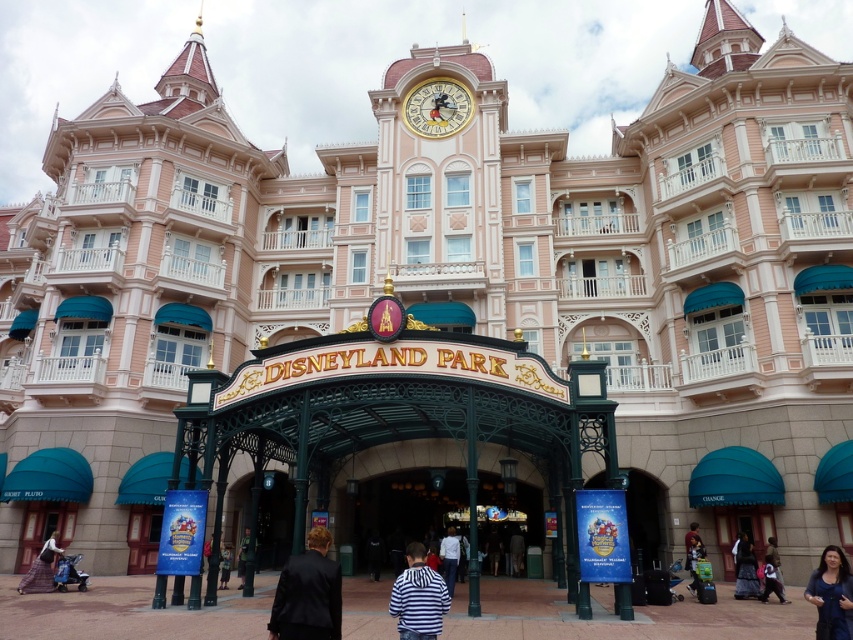
You are a photographer standing at the entrance of Disneyland Park. You want to capture a photo of both the blue satin dress at lower right and the dark blue fabric pants at lower right in the same frame. Given that your camera has a maximum focal length that allows capturing objects up to 12 meters apart, will you be able to include both items in your photo?

The blue satin dress at lower right and dark blue fabric pants at lower right are 13.17 meters apart, which exceeds the camera maximum focal length of 12 meters. Therefore, you cannot include both items in the same photo.

You are standing at the entrance of Disneyland Park and want to take a photo of the gold metallic clock at upper center. Where should you look to find it?

The gold metallic clock at upper center is located at point (437, 108), so you should look towards that coordinate to find it.